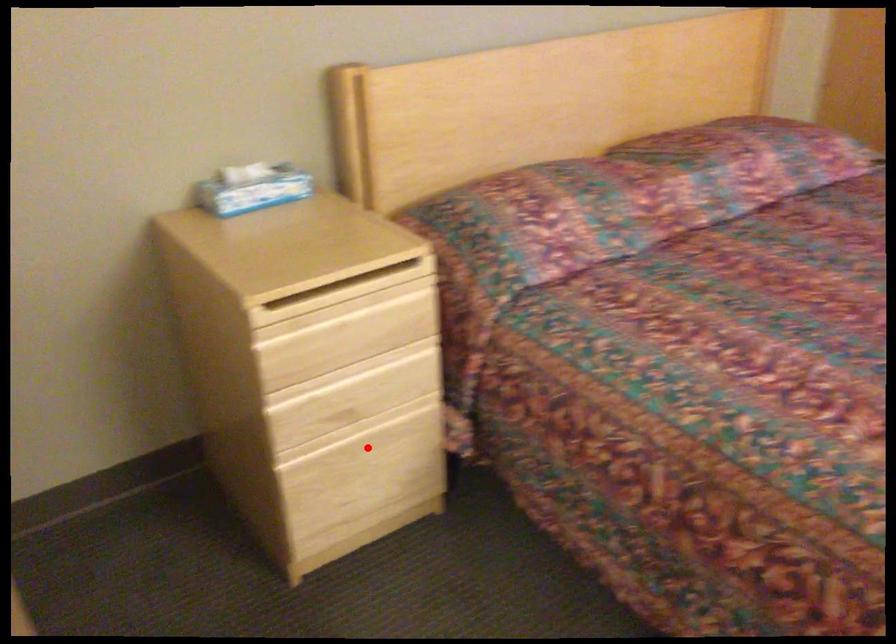
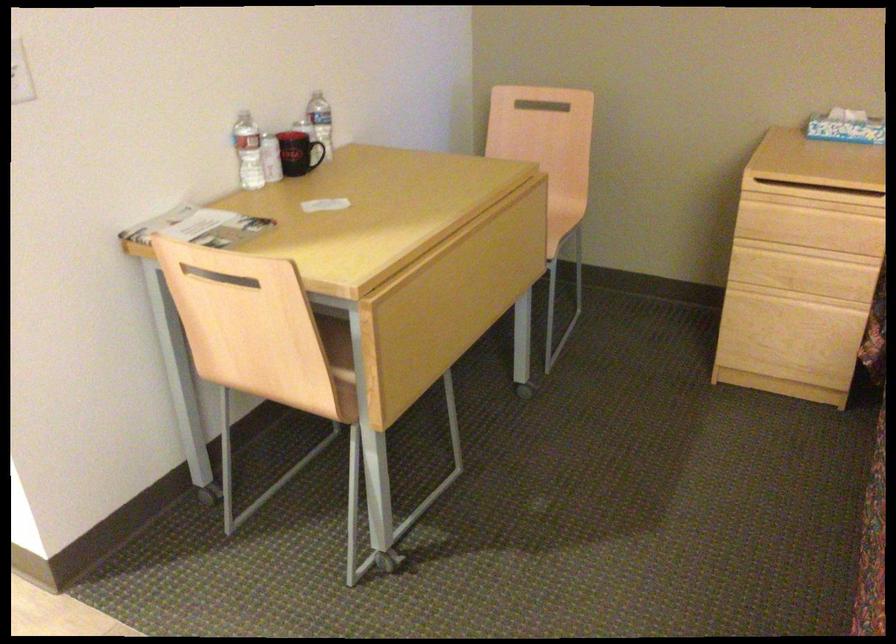
Question: I am providing you with two images of the same scene from different viewpoints. Given a red point in image1, look at the same physical point in image2. Is it:

Choices:
 (A) Closer to the viewpoint
 (B) Farther from the viewpoint

Answer: (B)